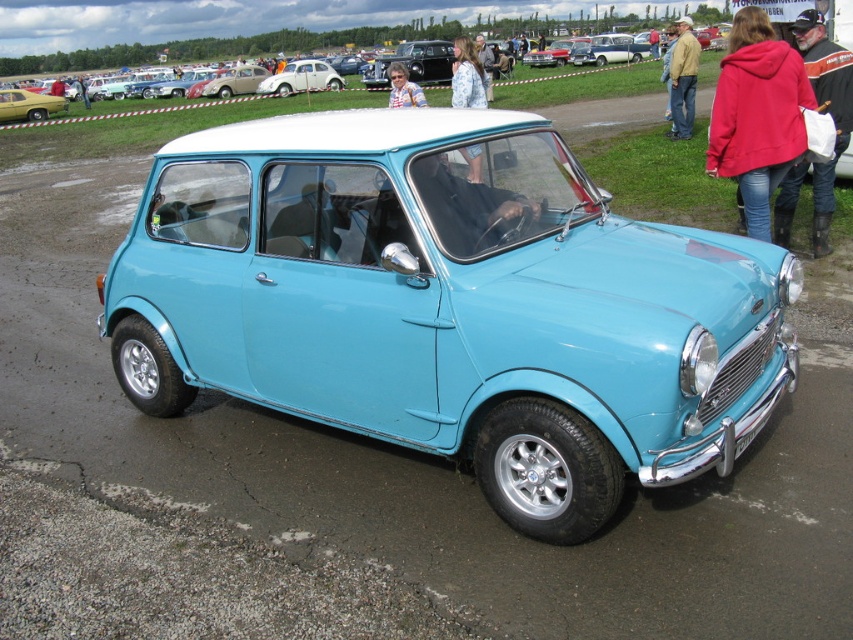
You are standing at the car show and want to take a photo of the vintage Mini Cooper. The camera you have can focus on objects up to 40 meters away. Is the point at coordinates point (368, 77) within the camera focus range?

The point at coordinates point (368, 77) is 36.75 meters from the viewer, which is within the camera focus range of up to 40 meters. Therefore, the camera can focus on that point.